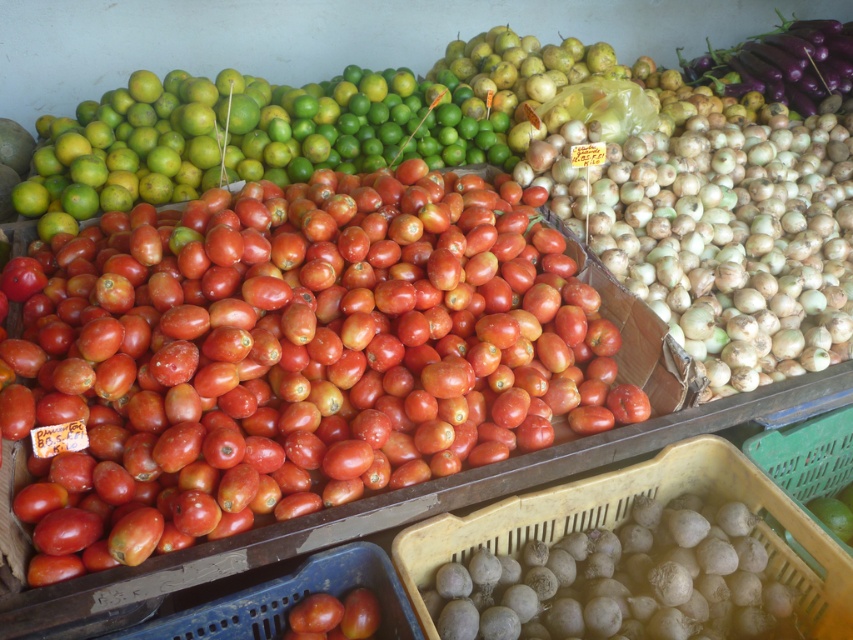
Which of these two, shiny red tomato at center or shiny red tomatoes at center, stands taller?

shiny red tomato at center

Can you confirm if shiny red tomato at center is taller than shiny red tomatoes at center?

Correct, shiny red tomato at center is much taller as shiny red tomatoes at center.

Does point (90, 492) come closer to viewer compared to point (427, 124)?

That is True.

The height and width of the screenshot is (640, 853). Identify the location of shiny red tomato at center. (289, 374).